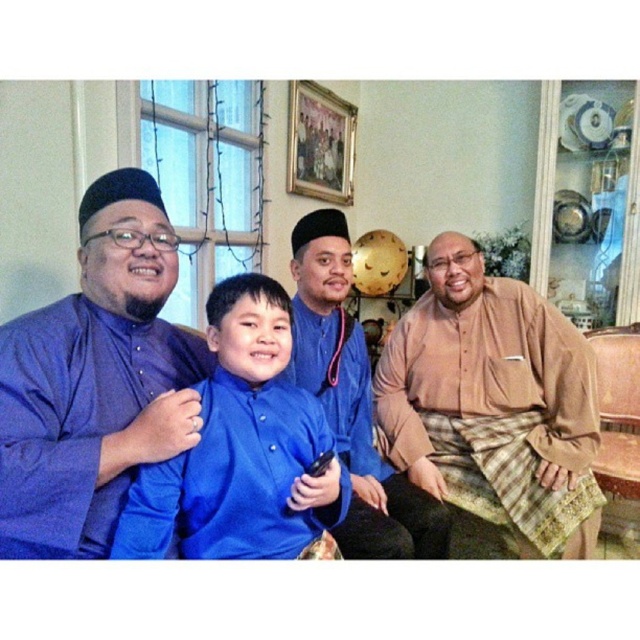
In the scene shown: You are a photographer setting up a photo shoot in this living room. You need to position a backdrop that must be taller than the tallest object between the beige textured shirt at right and the matte blue kurta at center. What is the minimum height the backdrop should be?

The beige textured shirt at right has a greater height compared to matte blue kurta at center. Therefore, the backdrop should be at least as tall as the beige textured shirt at right to accommodate the tallest object.

You are a tailor who needs to determine which garment requires more fabric for alterations. Based on the image, which of the two garments, the beige textured shirt at right or the matte blue kurta at center, would need more fabric due to its size?

The beige textured shirt at right requires more fabric because its width surpasses that of the matte blue kurta at center, indicating a larger size.

You are a photographer trying to capture a group photo of the beige textured shirt at right and the matte blue kurta at center. Based on their positions, which one should you place on the left side of the frame to ensure they are aligned with their current arrangement?

The matte blue kurta at center should be placed on the left side of the frame because the beige textured shirt at right is positioned on the right side of the matte blue kurta at center in the current arrangement.